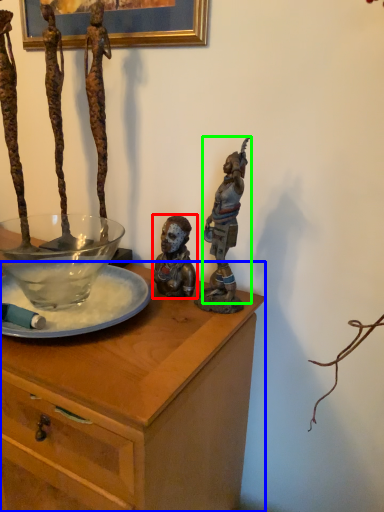
Question: Which is farther away from person (highlighted by a red box)? desk (highlighted by a blue box) or person (highlighted by a green box)?

Choices:
 (A) desk
 (B) person

Answer: (A)